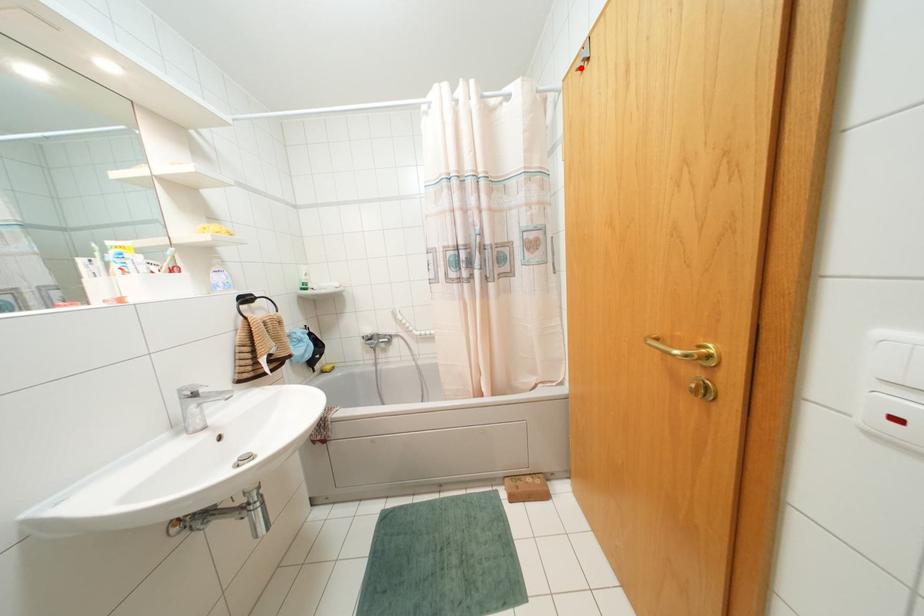
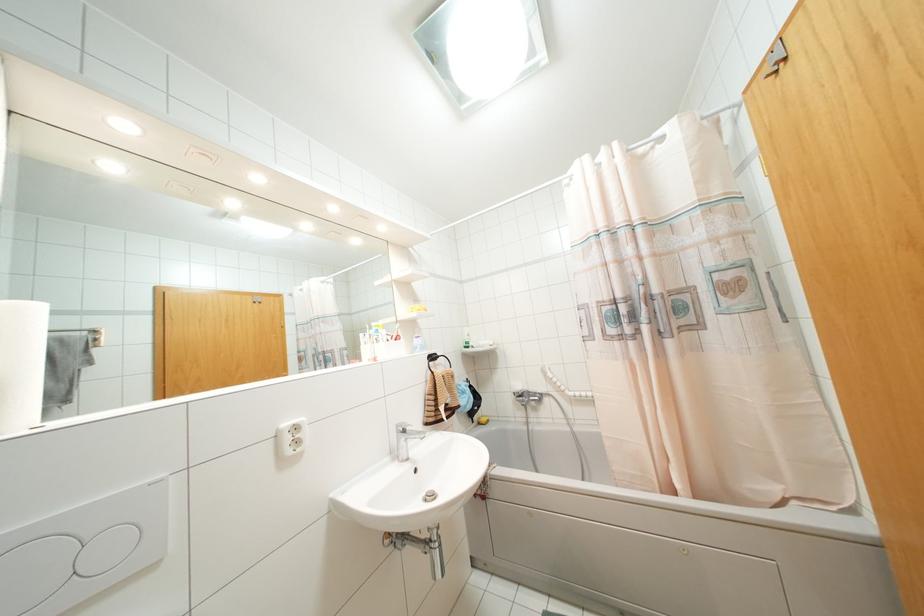
Locate, in the second image, the point that corresponds to the highlighted location in the first image.

(775, 71)